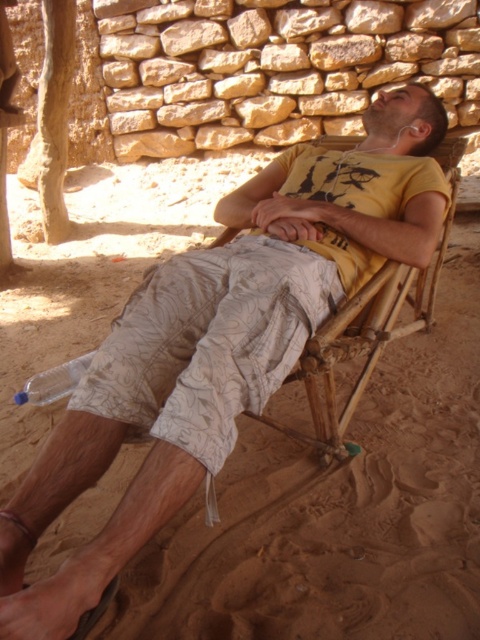
You are a photographer trying to capture a full view of the bamboo beach chair at center and the white textured shorts at center in a single shot. Based on their heights, which object should you focus on first to ensure both are in frame?

The bamboo beach chair at center is taller than the white textured shorts at center. To capture both in a single shot, focus on the bamboo beach chair at center first as it is taller and ensure it fits within the frame before adjusting for the shorter shorts.

You are standing 5 feet away from the wall in the image. You want to place a 3.5 feet wide painting on the wall so that it is centered between the man and the white textured shorts at center. Is there enough space for the painting?

The white textured shorts at center is 3.84 feet away from the viewer. Since you are standing 5 feet away from the wall, the distance between the viewer and the wall is 5 feet. The painting requires 3.5 feet of width, but the available space between the man and the white textured shorts at center isn